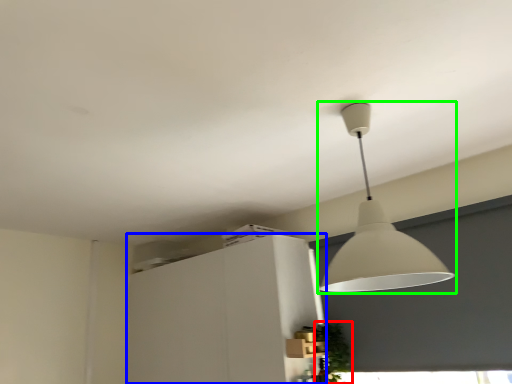
Question: Considering the real-world distances, which object is closest to plant (highlighted by a red box)? cabinetry (highlighted by a blue box) or lamp (highlighted by a green box).

Choices:
 (A) cabinetry
 (B) lamp

Answer: (A)